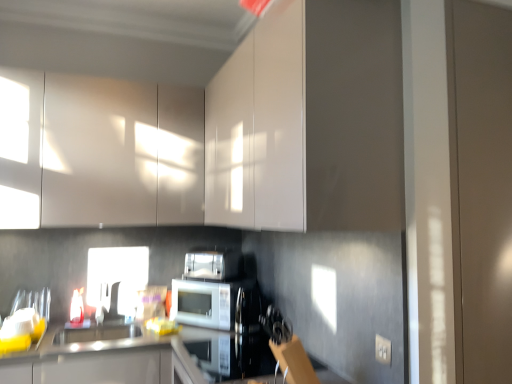
Question: From the image's perspective, is glossy white cabinet at upper center, placed as the second cabinetry when sorted from left to right, located above white plastic electric outlet at lower right?

Choices:
 (A) yes
 (B) no

Answer: (A)

Question: Can you confirm if glossy white cabinet at upper center, placed as the second cabinetry when sorted from left to right, is thinner than white plastic electric outlet at lower right?

Choices:
 (A) yes
 (B) no

Answer: (B)

Question: Could you tell me if glossy white cabinet at upper center, placed as the second cabinetry when sorted from left to right, is turned towards white plastic electric outlet at lower right?

Choices:
 (A) no
 (B) yes

Answer: (A)

Question: Does glossy white cabinet at upper center, which is counted as the 1th cabinetry, starting from the right, appear on the right side of white plastic electric outlet at lower right?

Choices:
 (A) no
 (B) yes

Answer: (A)

Question: Considering the relative positions of glossy white cabinet at upper center, placed as the second cabinetry when sorted from left to right, and white plastic electric outlet at lower right in the image provided, is glossy white cabinet at upper center, placed as the second cabinetry when sorted from left to right, behind white plastic electric outlet at lower right?

Choices:
 (A) yes
 (B) no

Answer: (B)

Question: In terms of height, does glossy white cabinets at upper left, which is the 2th cabinetry in right-to-left order, look taller or shorter compared to satin silver toaster at center?

Choices:
 (A) tall
 (B) short

Answer: (A)

Question: Considering the positions of point (129, 165) and point (196, 264), is point (129, 165) closer or farther from the camera than point (196, 264)?

Choices:
 (A) farther
 (B) closer

Answer: (B)

Question: Looking at their shapes, would you say glossy white cabinets at upper left, which is the 2th cabinetry in right-to-left order, is wider or thinner than satin silver toaster at center?

Choices:
 (A) thin
 (B) wide

Answer: (B)

Question: Is glossy white cabinets at upper left, which is the 2th cabinetry in right-to-left order, in front of or behind satin silver toaster at center in the image?

Choices:
 (A) front
 (B) behind

Answer: (A)

Question: Considering the positions of white glossy sink at lower center and glossy white cabinet at upper center, which is counted as the 1th cabinetry, starting from the right, in the image, is white glossy sink at lower center taller or shorter than glossy white cabinet at upper center, which is counted as the 1th cabinetry, starting from the right,?

Choices:
 (A) tall
 (B) short

Answer: (B)

Question: Considering their positions, is white glossy sink at lower center located in front of or behind glossy white cabinet at upper center, placed as the second cabinetry when sorted from left to right?

Choices:
 (A) behind
 (B) front

Answer: (A)

Question: Is white glossy sink at lower center bigger or smaller than glossy white cabinet at upper center, which is counted as the 1th cabinetry, starting from the right?

Choices:
 (A) small
 (B) big

Answer: (A)

Question: Looking at their shapes, would you say white glossy sink at lower center is wider or thinner than glossy white cabinet at upper center, placed as the second cabinetry when sorted from left to right?

Choices:
 (A) wide
 (B) thin

Answer: (B)

Question: Is satin silver toaster at center bigger or smaller than glossy white cabinets at upper left, the 1th cabinetry from the left?

Choices:
 (A) big
 (B) small

Answer: (B)

Question: In terms of height, does satin silver toaster at center look taller or shorter compared to glossy white cabinets at upper left, the 1th cabinetry from the left?

Choices:
 (A) tall
 (B) short

Answer: (B)